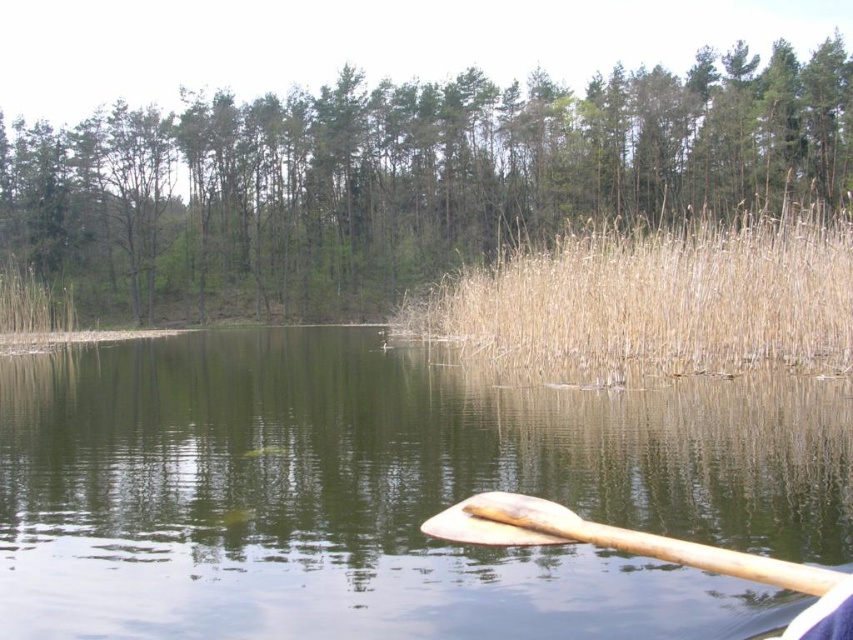
Question: Estimate the real-world distances between objects in this image. Which object is closer to the greenish water at lower center?

Choices:
 (A) dry grass at center
 (B) wooden paddle at lower right
 (C) green matte tree at upper center

Answer: (B)

Question: Is green matte tree at upper center to the left of dry grass at center from the viewer's perspective?

Choices:
 (A) no
 (B) yes

Answer: (B)

Question: Does dry grass at center have a greater width compared to wooden paddle at lower right?

Choices:
 (A) yes
 (B) no

Answer: (A)

Question: Can you confirm if green matte tree at upper center is positioned to the right of brown dry reed at left?

Choices:
 (A) no
 (B) yes

Answer: (B)

Question: Which point appears closest to the camera in this image?

Choices:
 (A) (428, 524)
 (B) (454, 458)
 (C) (712, 224)
 (D) (51, 312)

Answer: (A)

Question: Estimate the real-world distances between objects in this image. Which object is farther from the green matte tree at upper center?

Choices:
 (A) greenish water at lower center
 (B) brown dry reed at left
 (C) wooden paddle at lower right

Answer: (C)